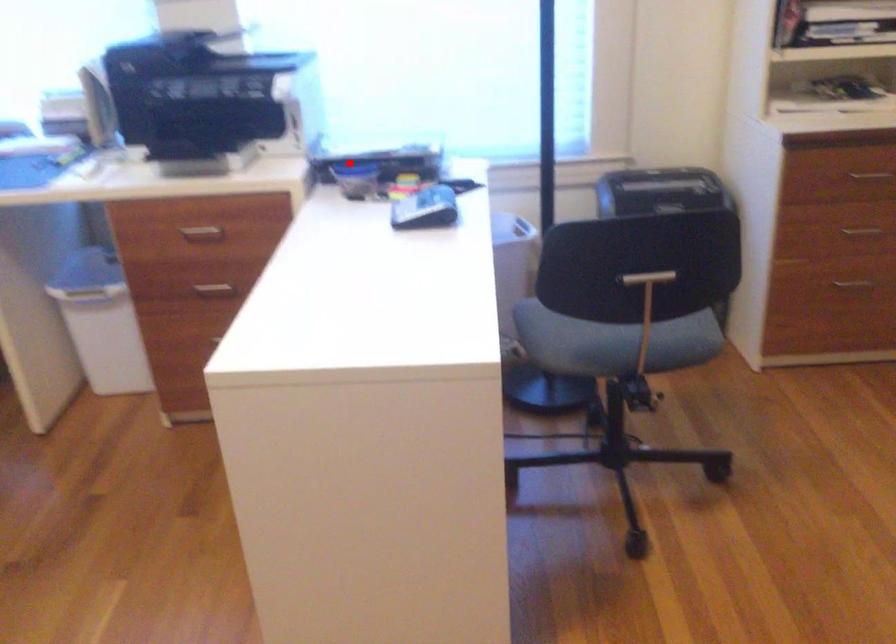
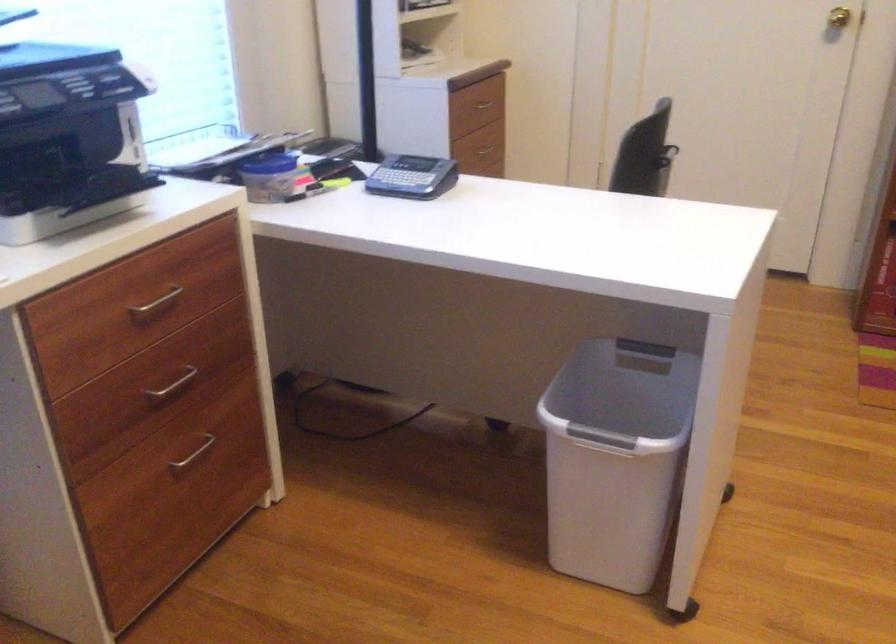
Question: I am providing you with two images of the same scene from different viewpoints. In image1, a red point is highlighted. Considering the same 3D point in image2, which of the following is correct?

Choices:
 (A) It is closer
 (B) It is farther

Answer: (A)